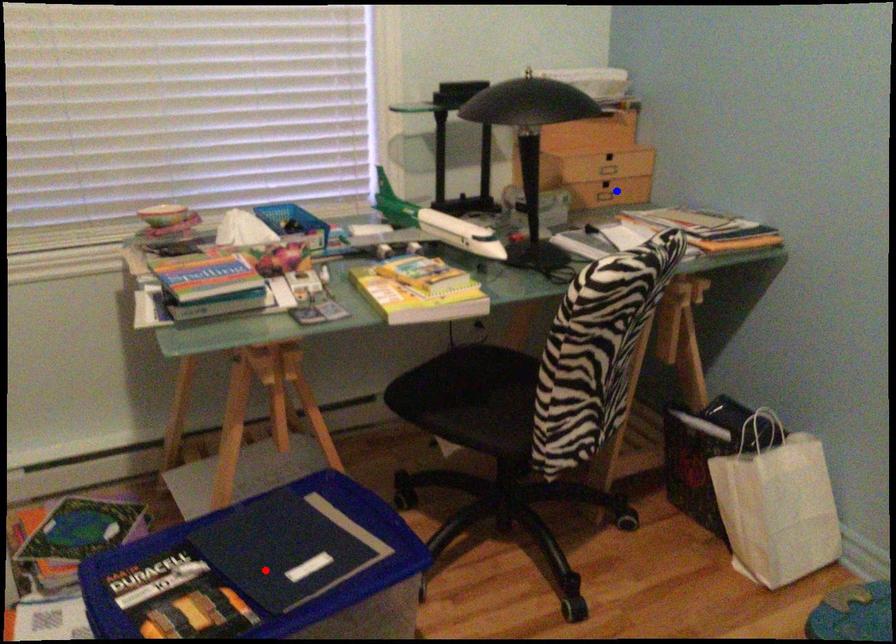
Question: Two points are marked on the image. Which point is closer to the camera?

Choices:
 (A) Blue point is closer.
 (B) Red point is closer.

Answer: (B)